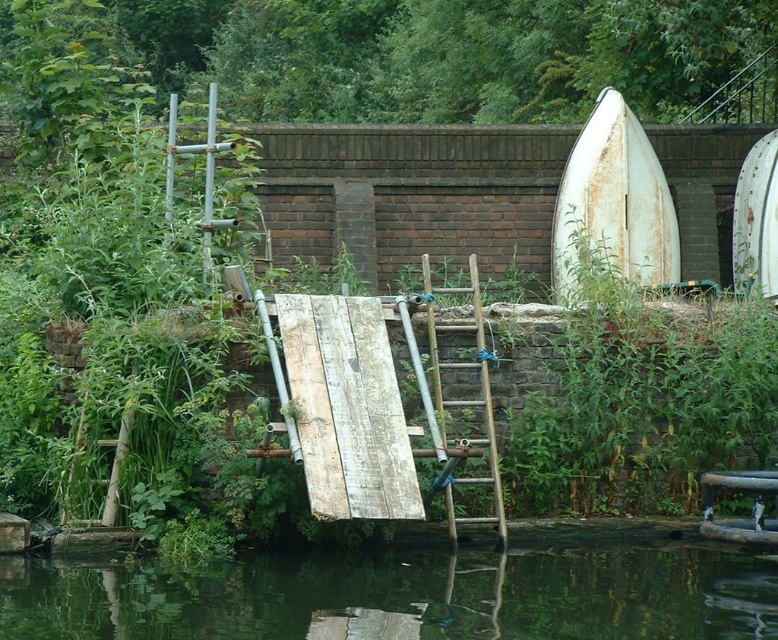
Can you confirm if green smooth water at lower center is bigger than rusty white boat at upper right?

Incorrect, green smooth water at lower center is not larger than rusty white boat at upper right.

Find the location of `green smooth water at lower center`. green smooth water at lower center is located at coordinates (401, 595).

Based on the photo, who is more forward, (696, 616) or (650, 198)?

Point (696, 616) is more forward.

Locate an element on the screen. This screenshot has height=640, width=778. green smooth water at lower center is located at coordinates (401, 595).

Who is more distant from viewer, (640, 634) or (475, 257)?

The point (475, 257) is behind.

In the scene shown: Can you confirm if green smooth water at lower center is wider than wooden ladder at center?

Yes.

Which is in front, point (517, 563) or point (472, 360)?

Point (517, 563) is more forward.

Where is `green smooth water at lower center`? This screenshot has width=778, height=640. green smooth water at lower center is located at coordinates (401, 595).

Does wooden ladder at center have a lesser width compared to white matte surfboard at upper right?

In fact, wooden ladder at center might be wider than white matte surfboard at upper right.

Is wooden ladder at center to the left of white matte surfboard at upper right from the viewer's perspective?

Yes, wooden ladder at center is to the left of white matte surfboard at upper right.

Locate an element on the screen. The image size is (778, 640). wooden ladder at center is located at coordinates 464,397.

At what (x,y) coordinates should I click in order to perform the action: click on wooden ladder at center. Please return your answer as a coordinate pair (x, y). Looking at the image, I should click on (464, 397).